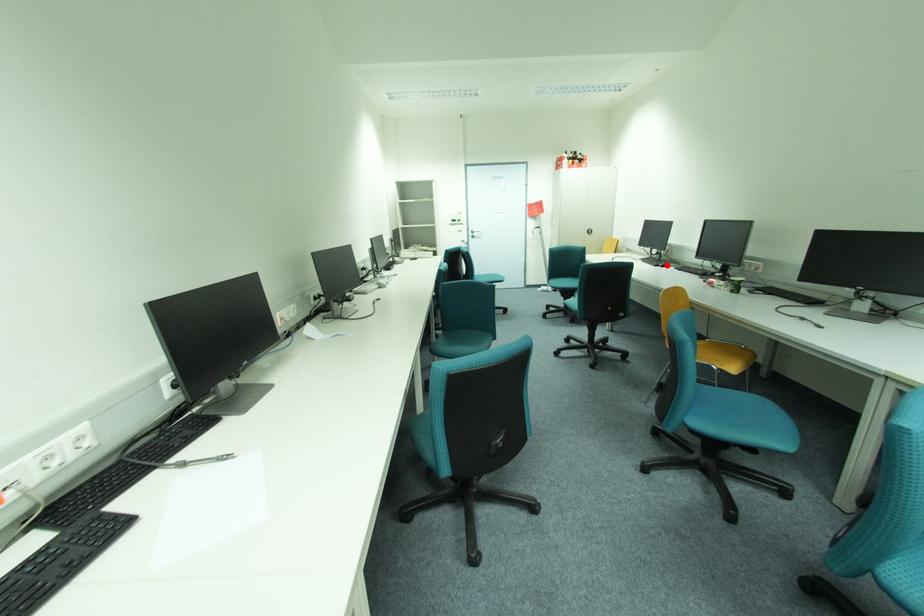
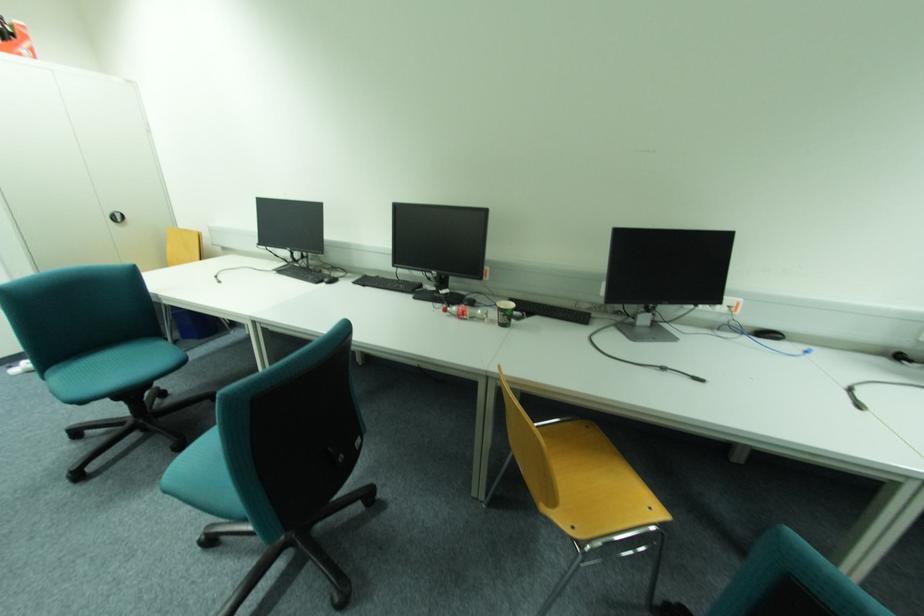
Question: I am providing you with two images of the same scene from different viewpoints. In image1, a red point is highlighted. Considering the same 3D point in image2, which of the following is correct?

Choices:
 (A) It is closer
 (B) It is farther

Answer: (A)